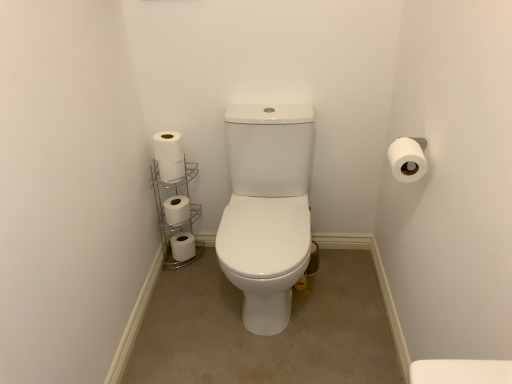
Question: Relative to white matte toilet paper at lower left, which ranks as the 3th toilet paper in right-to-left order, is white metallic toilet paper holder at lower left in front or behind?

Choices:
 (A) behind
 (B) front

Answer: (B)

Question: Is white metallic toilet paper holder at lower left wider or thinner than white matte toilet paper at lower left, placed as the 3th toilet paper when sorted from left to right?

Choices:
 (A) wide
 (B) thin

Answer: (A)

Question: Which is farther from the white matte toilet paper at left, placed as the 4th toilet paper when sorted from back to front?

Choices:
 (A) white matte toilet paper at left, the 3th toilet paper when ordered from front to back
 (B) white matte toilet paper at center-left, which appears as the fifth toilet paper when viewed from the right
 (C) white matte toilet paper at upper right, marked as the fifth toilet paper in a back-to-front arrangement
 (D) white matte toilet paper at lower left, which ranks as the 3th toilet paper in right-to-left order
 (E) white metallic toilet paper holder at lower left

Answer: (C)

Question: Which object is the closest to the white matte toilet paper at upper right, marked as the 3th toilet paper in a top-to-bottom arrangement?

Choices:
 (A) white matte toilet paper at left, which is the 2th toilet paper from front to back
 (B) white matte toilet paper at center-left, marked as the 2th toilet paper in a bottom-to-top arrangement
 (C) white matte toilet paper at left, acting as the fourth toilet paper starting from the bottom
 (D) white metallic toilet paper holder at lower left
 (E) white matte toilet paper at lower left, positioned as the fifth toilet paper in top-to-bottom order

Answer: (A)